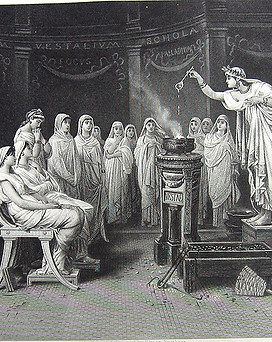
You are a GUI agent. You are given a task and a screenshot of the screen. Output one action in this format:
    pyautogui.click(x=<x>, y=<y>)
    Task: Click on the spoon handle
    The image size is (272, 342).
    Given the screenshot: What is the action you would take?
    pyautogui.click(x=249, y=211), pyautogui.click(x=184, y=77)